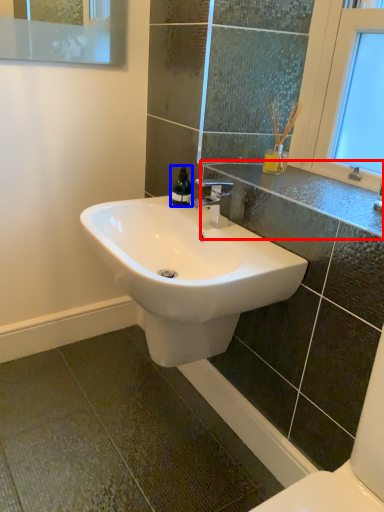
Question: Among these objects, which one is nearest to the camera, counter top (highlighted by a red box) or soap dispenser (highlighted by a blue box)?

Choices:
 (A) counter top
 (B) soap dispenser

Answer: (A)